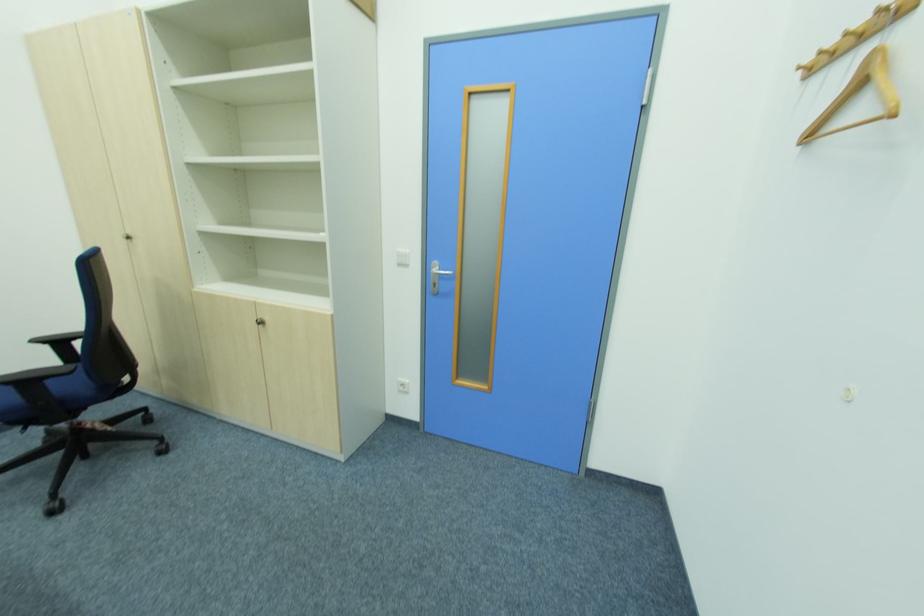
Describe the element at coordinates (436, 278) in the screenshot. I see `the metal door handle` at that location.